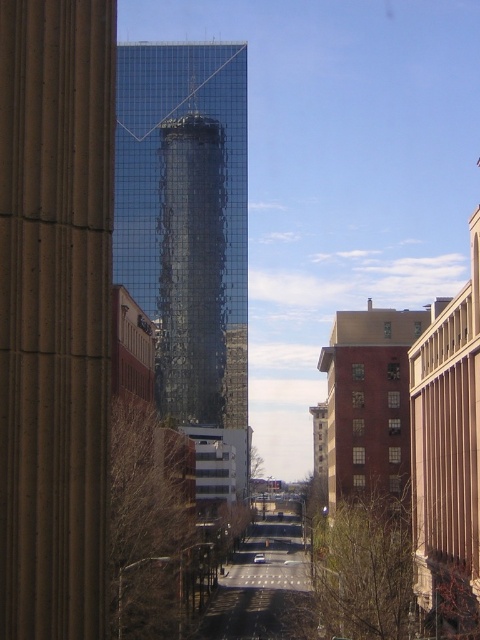
Between brown stone pillar at left and glossy glass skyscraper at center, which one appears on the right side from the viewer's perspective?

brown stone pillar at left is more to the right.

In the scene shown: Does brown stone pillar at left appear under glossy glass skyscraper at center?

Yes, brown stone pillar at left is below glossy glass skyscraper at center.

Between point (46, 472) and point (211, 138), which one is positioned behind?

The point (211, 138) is more distant.

Locate an element on the screen. brown stone pillar at left is located at coordinates (55, 312).